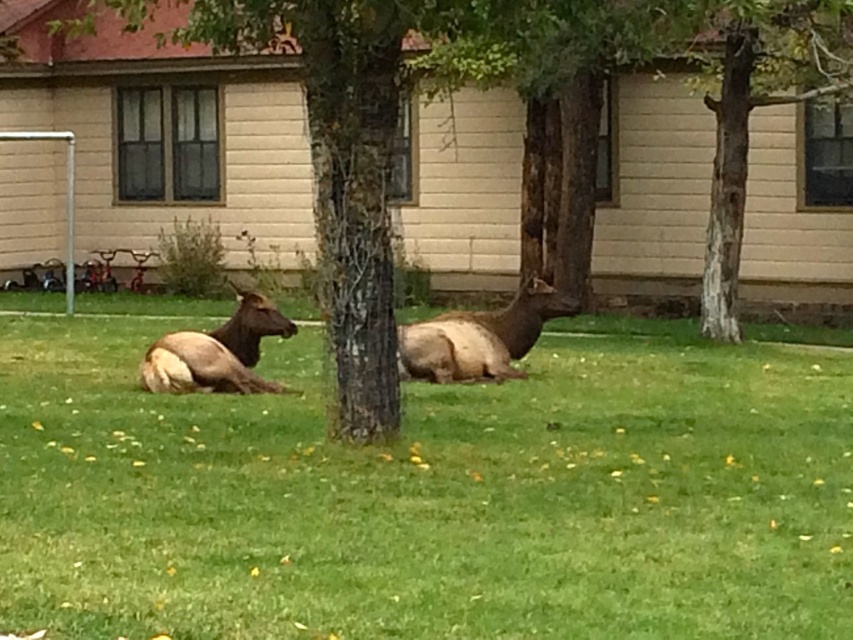
Which is behind, point (397, 449) or point (815, 12)?

The point (815, 12) is more distant.

Does green grass at center appear over white textured bark at center?

Incorrect, green grass at center is not positioned above white textured bark at center.

What do you see at coordinates (427, 493) in the screenshot?
I see `green grass at center` at bounding box center [427, 493].

Find the location of a particular element. green grass at center is located at coordinates (427, 493).

Can you confirm if white textured bark at center is thinner than brown furry deer at left?

Yes, white textured bark at center is thinner than brown furry deer at left.

Is point (712, 237) closer to viewer compared to point (219, 342)?

No, it is behind (219, 342).

Between point (817, 49) and point (196, 376), which one is positioned in front?

Positioned in front is point (196, 376).

I want to click on white textured bark at center, so coord(750,104).

From the picture: Is green bark tree at center to the left of brown furry deer at left from the viewer's perspective?

No, green bark tree at center is not to the left of brown furry deer at left.

How far apart are green bark tree at center and brown furry deer at left?

The distance of green bark tree at center from brown furry deer at left is 16.60 feet.

Find the location of `green bark tree at center`. green bark tree at center is located at coordinates (525, 125).